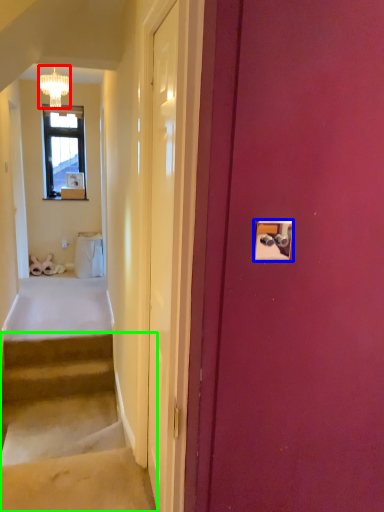
Question: Which object is the closest to the lamp (highlighted by a red box)? Choose among these: light switch (highlighted by a blue box) or stairs (highlighted by a green box).

Choices:
 (A) light switch
 (B) stairs

Answer: (A)